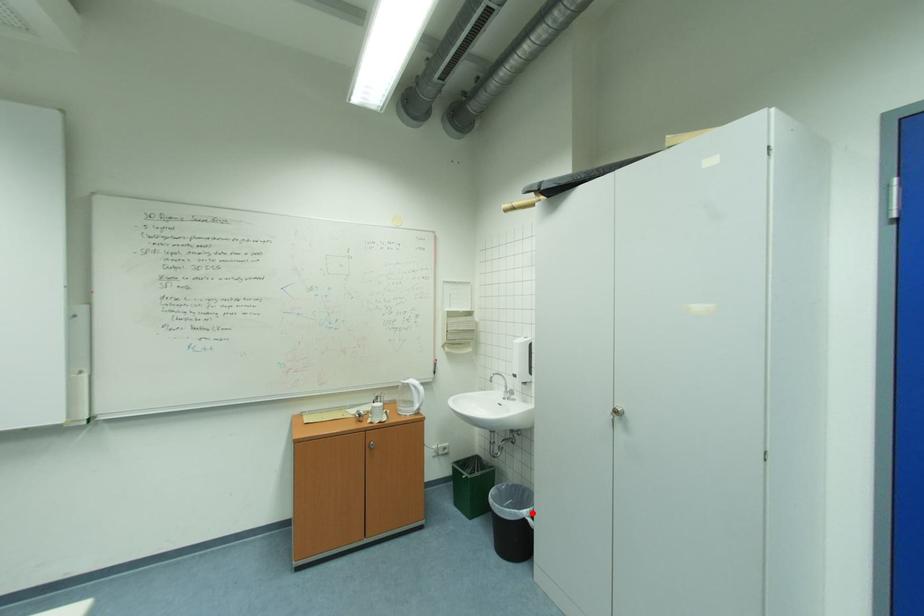
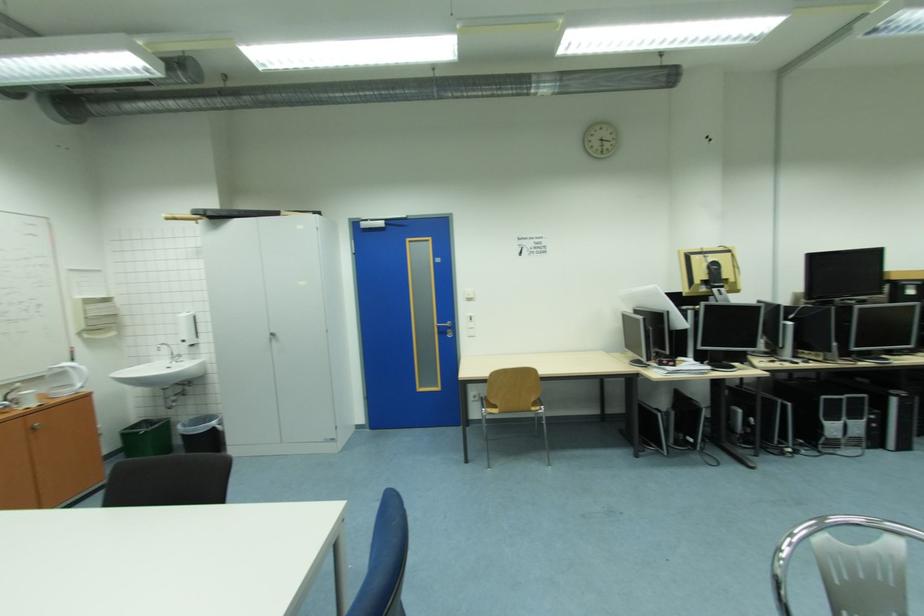
Question: I am providing you with two images of the same scene from different viewpoints. A red point is marked on the first image. At the location where the point appears in image 1, is it still visible in image 2?

Choices:
 (A) Yes
 (B) No

Answer: (A)